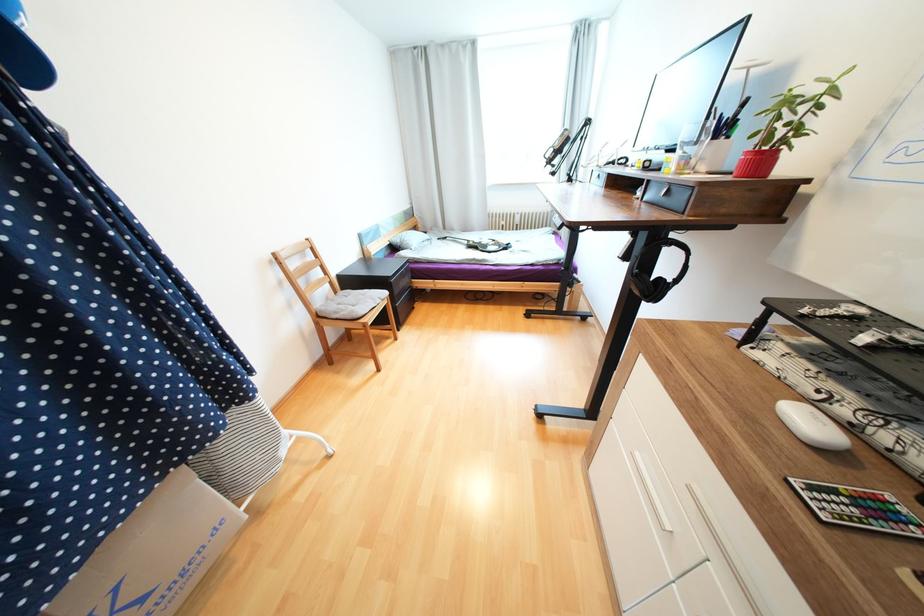
You are a GUI agent. You are given a task and a screenshot of the screen. Output one action in this format:
    pyautogui.click(x=<x>, y=<y>)
    Task: Click on the red plant pot
    The height and width of the screenshot is (616, 924).
    Given the screenshot: What is the action you would take?
    pyautogui.click(x=756, y=163)